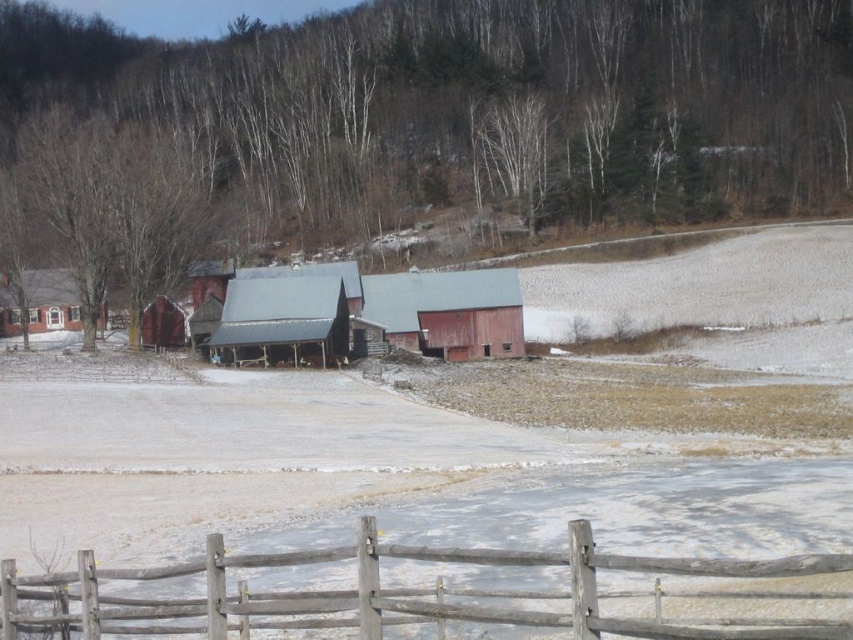
You are a farmer who wants to place a new storage shed between the rustic wooden barn at center and the brick house at left. Given that the shed requires 10 meters of space, can you determine if there is enough space between the two structures based on their widths?

The rustic wooden barn at center is wider than the brick house at left. However, the exact distance between them isn

You are standing at the edge of a snowy farm field and see the weathered wood fence at lower center and the brick house at left. Which object is positioned to the right of the other?

The weathered wood fence at lower center is to the right of the brick house at left.